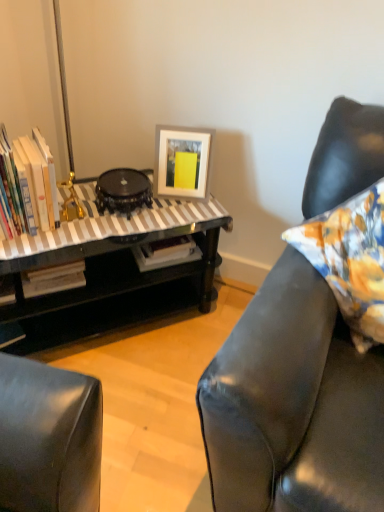
The image size is (384, 512). Find the location of `vacant space in front of white matte picture frame at upper center`. vacant space in front of white matte picture frame at upper center is located at coordinates (173, 211).